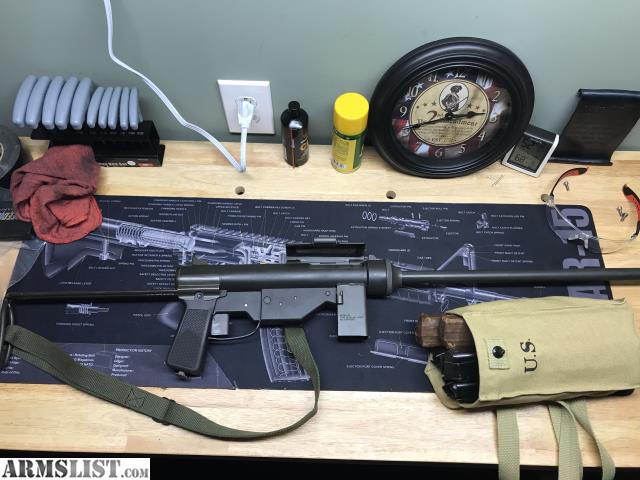
The height and width of the screenshot is (480, 640). Identify the location of mat. (498, 244).